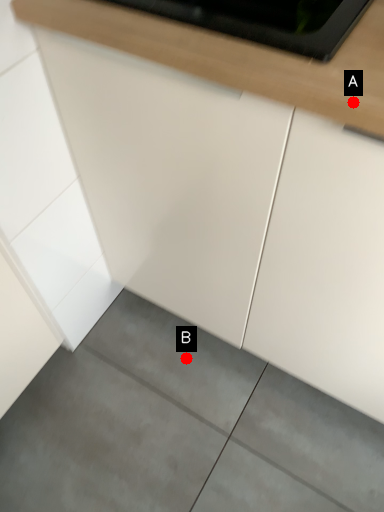
Question: Two points are circled on the image, labeled by A and B beside each circle. Which point is farther to the camera?

Choices:
 (A) A is further
 (B) B is further

Answer: (B)